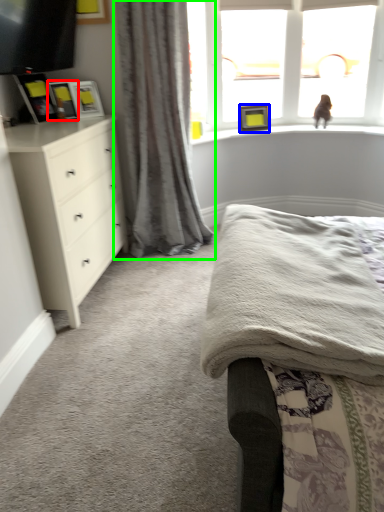
Question: Estimate the real-world distances between objects in this image. Which object is farther from picture frame (highlighted by a red box), picture frame (highlighted by a blue box) or curtain (highlighted by a green box)?

Choices:
 (A) picture frame
 (B) curtain

Answer: (A)